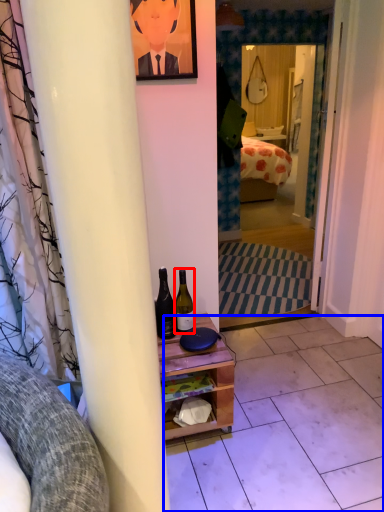
Question: Which object appears farthest to the camera in this image, bottle (highlighted by a red box) or tile (highlighted by a blue box)?

Choices:
 (A) bottle
 (B) tile

Answer: (A)